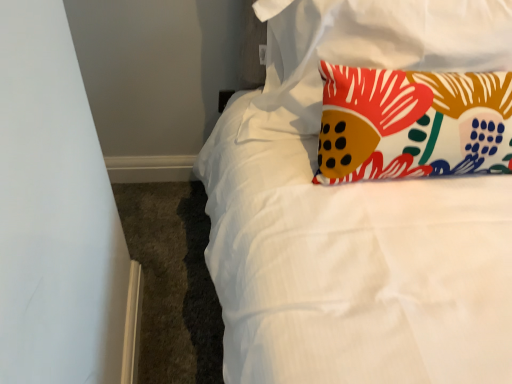
Question: Looking at their shapes, would you say floral fabric pillow at upper right, which is counted as the first pillow, starting from the top, is wider or thinner than floral fabric pillow at upper right, the 2th pillow when ordered from top to bottom?

Choices:
 (A) thin
 (B) wide

Answer: (A)

Question: In the image, is floral fabric pillow at upper right, which is counted as the first pillow, starting from the top, positioned in front of or behind floral fabric pillow at upper right, marked as the 1th pillow in a bottom-to-top arrangement?

Choices:
 (A) front
 (B) behind

Answer: (B)

Question: From the image's perspective, is floral fabric pillow at upper right, which is counted as the first pillow, starting from the top, positioned above or below floral fabric pillow at upper right, the 2th pillow when ordered from top to bottom?

Choices:
 (A) above
 (B) below

Answer: (A)

Question: Is point (435, 140) closer or farther from the camera than point (268, 115)?

Choices:
 (A) closer
 (B) farther

Answer: (A)

Question: Relative to floral fabric pillow at upper right, which is the 2th pillow from bottom to top, is floral fabric pillow at upper right, the 2th pillow when ordered from top to bottom, in front or behind?

Choices:
 (A) behind
 (B) front

Answer: (B)

Question: Is floral fabric pillow at upper right, the 2th pillow when ordered from top to bottom, taller or shorter than floral fabric pillow at upper right, which is the 2th pillow from bottom to top?

Choices:
 (A) tall
 (B) short

Answer: (A)

Question: From a real-world perspective, is floral fabric pillow at upper right, the 2th pillow when ordered from top to bottom, above or below floral fabric pillow at upper right, which is counted as the first pillow, starting from the top?

Choices:
 (A) below
 (B) above

Answer: (A)